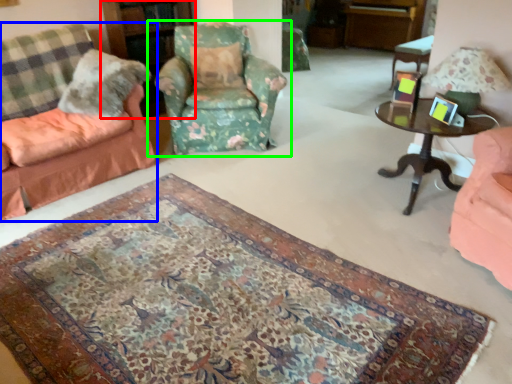
Question: Which object is positioned closest to bookshelf (highlighted by a red box)? Select from chair (highlighted by a blue box) and chair (highlighted by a green box).

Choices:
 (A) chair
 (B) chair

Answer: (B)